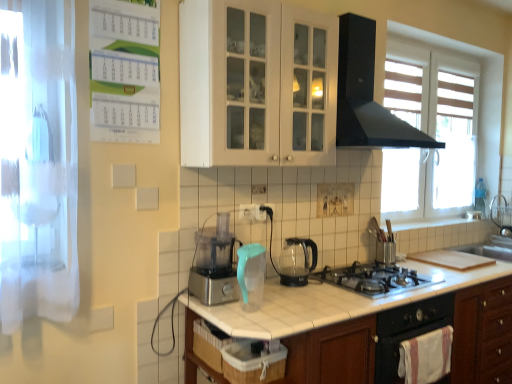
This screenshot has height=384, width=512. In order to click on black matte range hood at upper center in this screenshot , I will do `click(367, 95)`.

Image resolution: width=512 pixels, height=384 pixels. Describe the element at coordinates (374, 278) in the screenshot. I see `stainless steel gas stove at center` at that location.

At what (x,y) coordinates should I click in order to perform the action: click on white glass cabinet at upper center. Please return your answer as a coordinate pair (x, y). Looking at the image, I should click on (257, 84).

What is the approximate width of black plastic electric outlet at center, the second electric outlet from the left?

black plastic electric outlet at center, the second electric outlet from the left, is 1.12 inches in width.

This screenshot has width=512, height=384. In order to click on black matte oven at lower right in this screenshot , I will do (x=407, y=331).

What do you see at coordinates (297, 261) in the screenshot?
I see `transparent glass kettle at center` at bounding box center [297, 261].

Image resolution: width=512 pixels, height=384 pixels. I want to click on white tile countertop at center, so click(371, 325).

Does white tile countertop at center lie behind black matte oven at lower right?

No.

Between white tile countertop at center and black matte oven at lower right, which one has smaller size?

Smaller between the two is black matte oven at lower right.

From the image's perspective, which is above, white tile countertop at center or black matte oven at lower right?

From the image's view, black matte oven at lower right is above.

Can you confirm if white tile countertop at center is wider than black matte oven at lower right?

Yes.

How far apart are black plastic electric outlet at center, arranged as the 1th electric outlet when viewed from the right, and transparent glass kettle at center?

30.35 centimeters.

Considering the relative sizes of black plastic electric outlet at center, which appears as the 1th electric outlet when viewed from the back, and transparent glass kettle at center in the image provided, is black plastic electric outlet at center, which appears as the 1th electric outlet when viewed from the back, smaller than transparent glass kettle at center?

Yes, black plastic electric outlet at center, which appears as the 1th electric outlet when viewed from the back, is smaller than transparent glass kettle at center.

Which point is more distant from viewer, (265, 211) or (298, 267)?

The point (298, 267) is more distant.

Is black plastic electric outlet at center, positioned as the 2th electric outlet in front-to-back order, in front of or behind transparent glass kettle at center in the image?

In the image, black plastic electric outlet at center, positioned as the 2th electric outlet in front-to-back order, appears behind transparent glass kettle at center.

From a real-world perspective, between transparent fabric screen door at left and white tile countertop at center, who is vertically higher?

transparent fabric screen door at left.

Does transparent fabric screen door at left lie in front of white tile countertop at center?

Yes, transparent fabric screen door at left is in front of white tile countertop at center.

Is point (65, 21) positioned after point (334, 337)?

No, (65, 21) is closer to viewer.

Is transparent fabric screen door at left turned away from white tile countertop at center?

No, transparent fabric screen door at left is not facing the opposite direction of white tile countertop at center.

How many degrees apart are the facing directions of white plastic electric outlet at center, placed as the 2th electric outlet when sorted from right to left, and transparent fabric screen door at left?

The angle between the facing direction of white plastic electric outlet at center, placed as the 2th electric outlet when sorted from right to left, and the facing direction of transparent fabric screen door at left is 1.9 degrees.

Is transparent fabric screen door at left located within white plastic electric outlet at center, which appears as the second electric outlet when viewed from the back?

No.

Is white plastic electric outlet at center, the 1th electric outlet in the left-to-right sequence, positioned with its back to transparent fabric screen door at left?

No, white plastic electric outlet at center, the 1th electric outlet in the left-to-right sequence,'s orientation is not away from transparent fabric screen door at left.

Is point (249, 213) positioned before point (51, 8)?

No, (249, 213) is further to viewer.

Is transparent glass kettle at center aimed at white plastic electric outlet at center, placed as the 2th electric outlet when sorted from right to left?

No, transparent glass kettle at center does not turn towards white plastic electric outlet at center, placed as the 2th electric outlet when sorted from right to left.

Considering the relative sizes of transparent glass kettle at center and white plastic electric outlet at center, the 1th electric outlet in the left-to-right sequence, in the image provided, is transparent glass kettle at center thinner than white plastic electric outlet at center, the 1th electric outlet in the left-to-right sequence,?

Incorrect, the width of transparent glass kettle at center is not less than that of white plastic electric outlet at center, the 1th electric outlet in the left-to-right sequence.

Is the position of transparent glass kettle at center more distant than that of white plastic electric outlet at center, which appears as the second electric outlet when viewed from the back?

No, transparent glass kettle at center is closer to the viewer.

Measure the distance from transparent glass kettle at center to white plastic electric outlet at center, the 1th electric outlet in the left-to-right sequence.

transparent glass kettle at center is 14.80 inches away from white plastic electric outlet at center, the 1th electric outlet in the left-to-right sequence.

Is the surface of black matte oven at lower right in direct contact with black plastic electric outlet at center, arranged as the 1th electric outlet when viewed from the right?

No, black matte oven at lower right is not with black plastic electric outlet at center, arranged as the 1th electric outlet when viewed from the right.

Which electric outlet is the 2nd one when counting from the back of the black matte oven at lower right? Please provide its 2D coordinates.

[(265, 211)]

Choose the correct answer: Is black matte oven at lower right inside black plastic electric outlet at center, arranged as the 1th electric outlet when viewed from the right, or outside it?

black matte oven at lower right is located beyond the bounds of black plastic electric outlet at center, arranged as the 1th electric outlet when viewed from the right.

How distant is black matte oven at lower right from black plastic electric outlet at center, arranged as the 1th electric outlet when viewed from the right?

The distance of black matte oven at lower right from black plastic electric outlet at center, arranged as the 1th electric outlet when viewed from the right, is 34.65 inches.

Are transparent fabric screen door at left and black matte range hood at upper center far apart?

Yes, transparent fabric screen door at left and black matte range hood at upper center are located far from each other.

From a real-world perspective, is transparent fabric screen door at left over black matte range hood at upper center?

Incorrect, from a real-world perspective, transparent fabric screen door at left is lower than black matte range hood at upper center.

Which of these two, transparent fabric screen door at left or black matte range hood at upper center, is bigger?

black matte range hood at upper center is bigger.

Locate an element on the screen. The height and width of the screenshot is (384, 512). oven on the left of white tile countertop at center is located at coordinates (407, 331).

From a real-world perspective, count 2nd electric outlets upward from the transparent glass kettle at center and point to it. Please provide its 2D coordinates.

[(265, 211)]

When comparing their distances from black plastic electric outlet at center, positioned as the 2th electric outlet in front-to-back order, does white glass cabinet at upper center or stainless steel gas stove at center seem closer?

Based on the image, stainless steel gas stove at center appears to be nearer to black plastic electric outlet at center, positioned as the 2th electric outlet in front-to-back order.

Looking at the image, which one is located closer to transparent fabric screen door at left, black matte range hood at upper center or stainless steel gas stove at center?

Among the two, stainless steel gas stove at center is located nearer to transparent fabric screen door at left.

Estimate the real-world distances between objects in this image. Which object is closer to black matte oven at lower right, white plastic electric outlet at center, which is counted as the 1th electric outlet, starting from the front, or black plastic electric outlet at center, positioned as the 2th electric outlet in front-to-back order?

black plastic electric outlet at center, positioned as the 2th electric outlet in front-to-back order.

Looking at the image, which one is located closer to white plastic electric outlet at center, placed as the 2th electric outlet when sorted from right to left, white glass cabinet at upper center or black matte oven at lower right?

white glass cabinet at upper center is closer to white plastic electric outlet at center, placed as the 2th electric outlet when sorted from right to left.

Based on their spatial positions, is black matte oven at lower right or black plastic electric outlet at center, which appears as the 1th electric outlet when viewed from the back, closer to transparent glass kettle at center?

Based on the image, black plastic electric outlet at center, which appears as the 1th electric outlet when viewed from the back, appears to be nearer to transparent glass kettle at center.

Looking at this image, from the image, which object appears to be nearer to black matte range hood at upper center, transparent fabric screen door at left or black plastic electric outlet at center, which appears as the 1th electric outlet when viewed from the back?

The object closer to black matte range hood at upper center is black plastic electric outlet at center, which appears as the 1th electric outlet when viewed from the back.

Which object lies nearer to the anchor point black matte oven at lower right, white plastic electric outlet at center, which is counted as the 1th electric outlet, starting from the front, or transparent fabric screen door at left?

white plastic electric outlet at center, which is counted as the 1th electric outlet, starting from the front.

When comparing their distances from black matte oven at lower right, does stainless steel gas stove at center or white glass cabinet at upper center seem closer?

Based on the image, stainless steel gas stove at center appears to be nearer to black matte oven at lower right.

Find the location of a particular element. The image size is (512, 384). electric outlet between black plastic electric outlet at center, arranged as the 1th electric outlet when viewed from the right, and transparent glass kettle at center in the up-down direction is located at coordinates (247, 212).

At what (x,y) coordinates should I click in order to perform the action: click on kitchen appliance that lies between white glass cabinet at upper center and stainless steel gas stove at center from top to bottom. Please return your answer as a coordinate pair (x, y). The width and height of the screenshot is (512, 384). Looking at the image, I should click on (297, 261).

This screenshot has width=512, height=384. Find the location of `kitchen appliance between transparent fabric screen door at left and stainless steel gas stove at center in the horizontal direction`. kitchen appliance between transparent fabric screen door at left and stainless steel gas stove at center in the horizontal direction is located at coordinates (297, 261).

The image size is (512, 384). I want to click on cabinetry between transparent fabric screen door at left and white tile countertop at center, so click(257, 84).